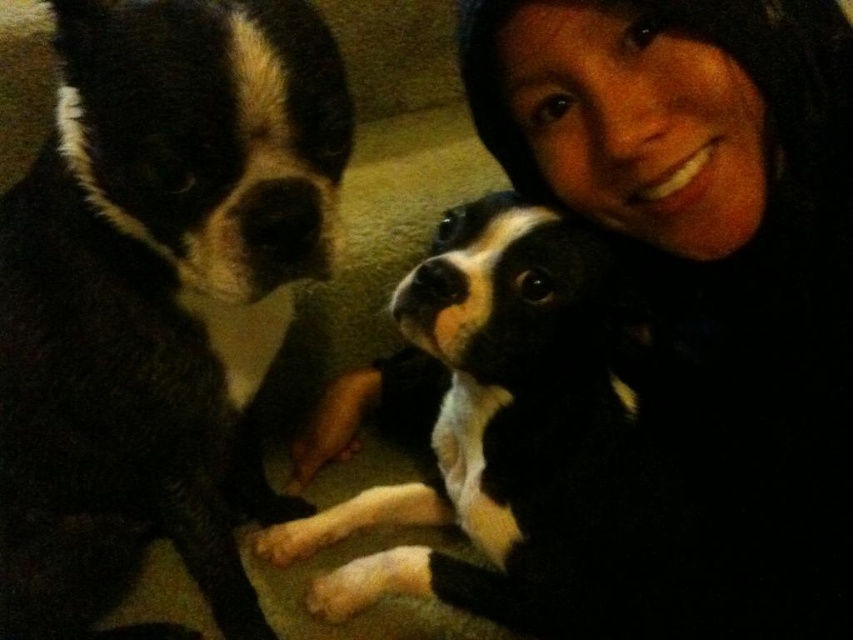
You are a photographer trying to capture a closeup of the black fur dog at left. The camera is currently focused on the point at coordinates point (157, 292). Is this the correct point to focus on to get a clear shot of the black fur dog at left?

Yes, the point (157, 292) corresponds to the black fur dog at left, so focusing there will capture it clearly.

You are a dog trainer assessing the space needed for two dogs. The black fur dog at left and the black and white fur at center are in the scene. Which dog requires more space due to its size?

The black and white fur at center requires more space because it has a greater width than the black fur dog at left.

Based on the coordinates provided, where is the black fur dog at left located in the image?

The black fur dog at left is located at point (157, 292).